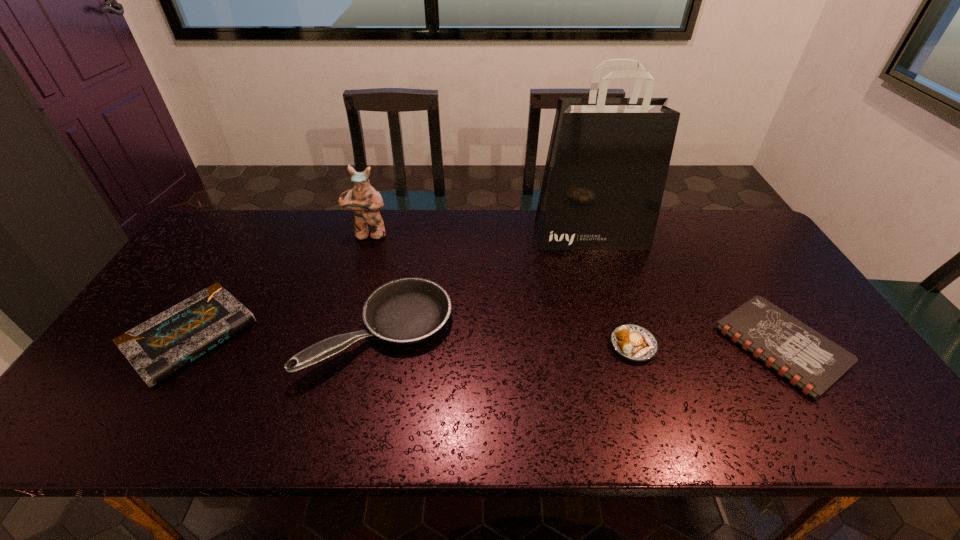
Where is `blank region between the shortest object and the tallest object`? Image resolution: width=960 pixels, height=540 pixels. blank region between the shortest object and the tallest object is located at coordinates (686, 291).

The image size is (960, 540). I want to click on object that is the closest one to the taller notebook, so click(x=408, y=310).

Identify the location of object that is the second closest to the figurine. (158, 348).

Where is `vacant region that satisfies the following two spatial constraints: 1. on the front with handles of the tallest object; 2. on the right side of the shortest object`? The image size is (960, 540). vacant region that satisfies the following two spatial constraints: 1. on the front with handles of the tallest object; 2. on the right side of the shortest object is located at coordinates (624, 346).

I want to click on vacant space that satisfies the following two spatial constraints: 1. on the front-facing side of the fifth shortest object; 2. on the right side of the frying pan, so click(339, 332).